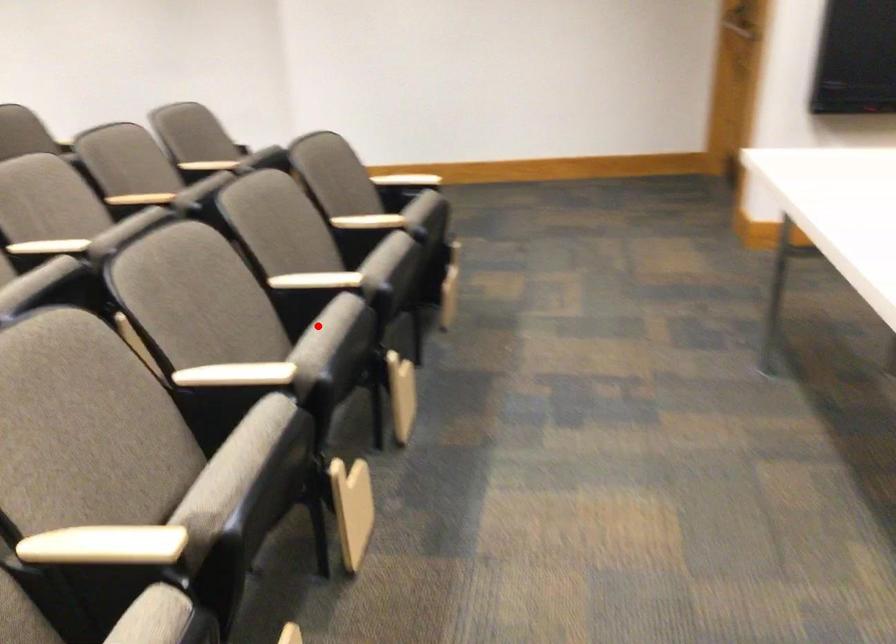
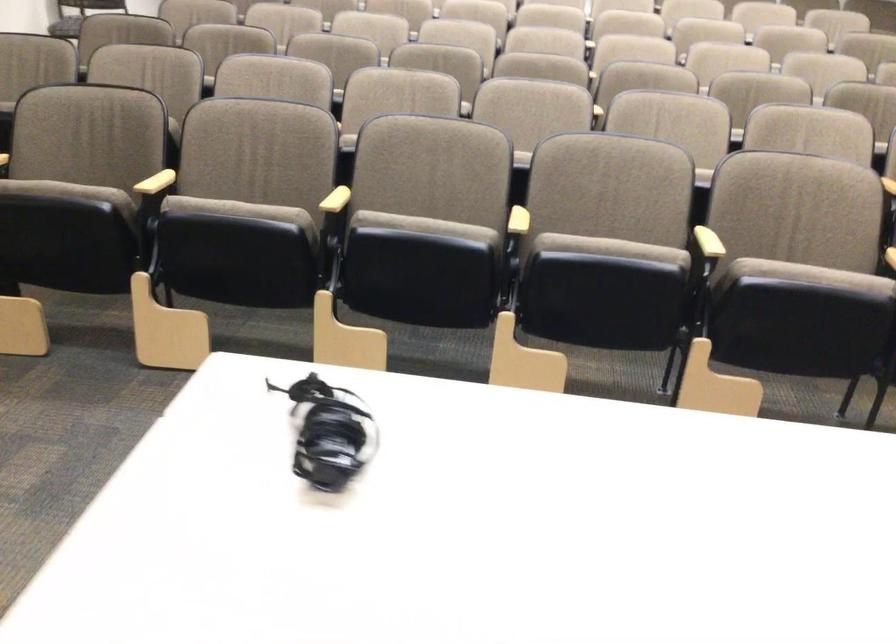
Question: I am providing you with two images of the same scene from different viewpoints. A red point is marked on the first image. Can you still see the location of the red point in image 2?

Choices:
 (A) Yes
 (B) No

Answer: (A)